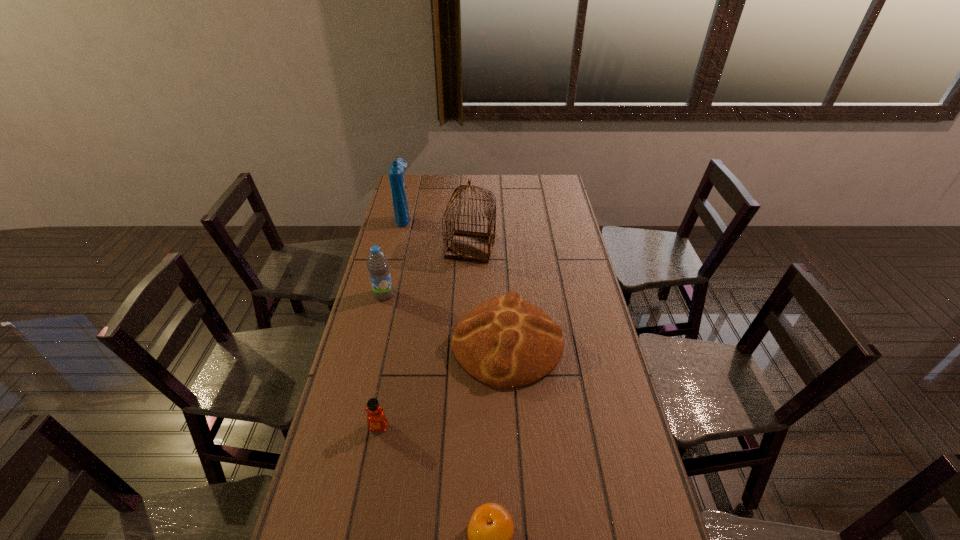
Image resolution: width=960 pixels, height=540 pixels. Identify the location of the fifth closest object to the birdcage. (490, 530).

I want to click on object that can be found as the fifth closest to the shampoo, so click(490, 530).